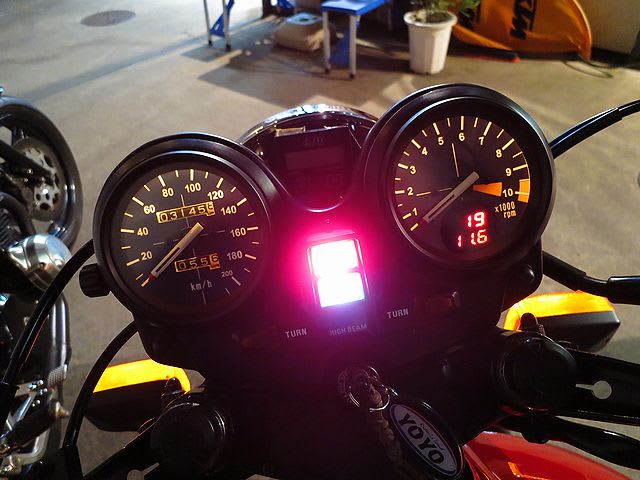
The image size is (640, 480). I want to click on keys, so click(364, 376).